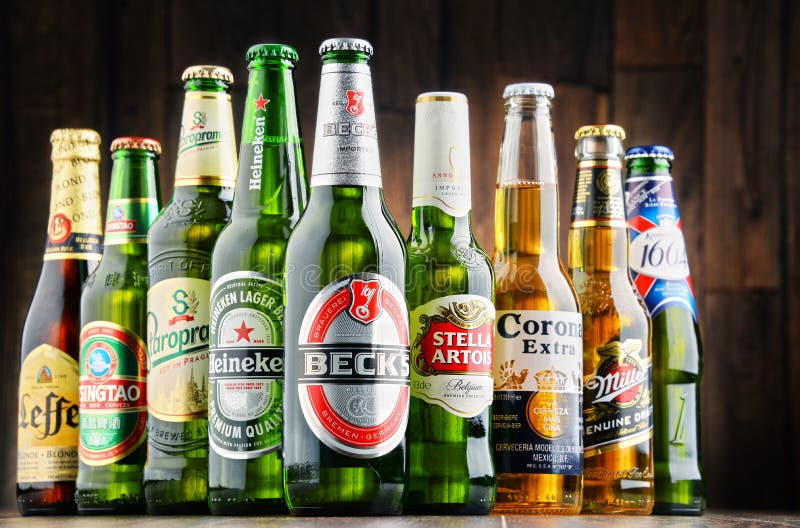
This screenshot has width=800, height=528. What are the coordinates of `beer bottles` in the screenshot? It's located at (40, 306), (114, 297), (196, 237), (238, 247), (346, 248), (446, 268), (536, 287), (612, 310), (686, 331).